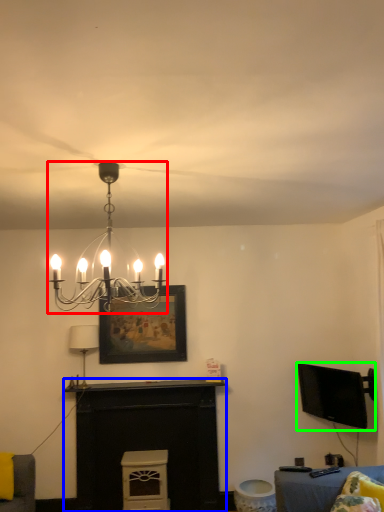
Question: Which object is the farthest from lamp (highlighted by a red box)? Choose among these: fireplace (highlighted by a blue box) or television (highlighted by a green box).

Choices:
 (A) fireplace
 (B) television

Answer: (B)